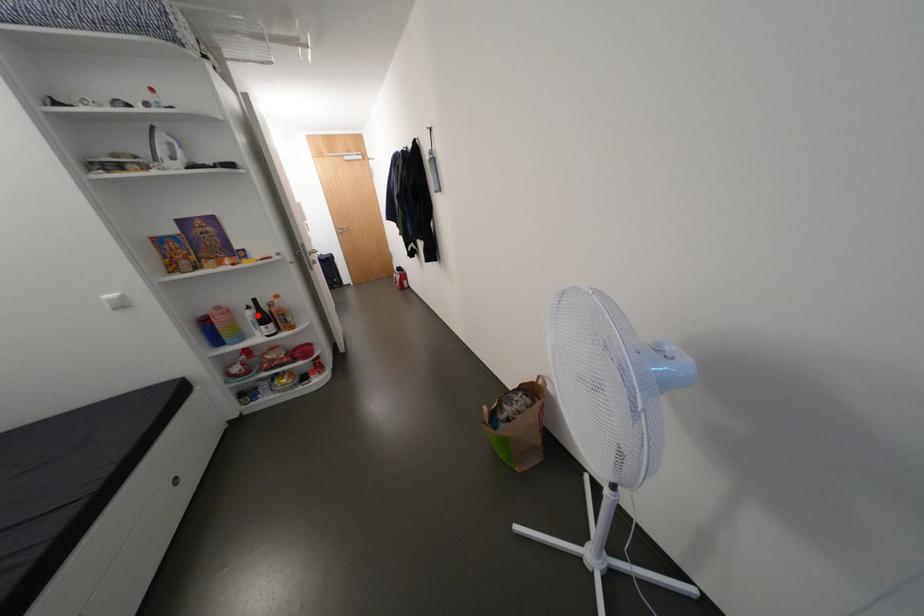
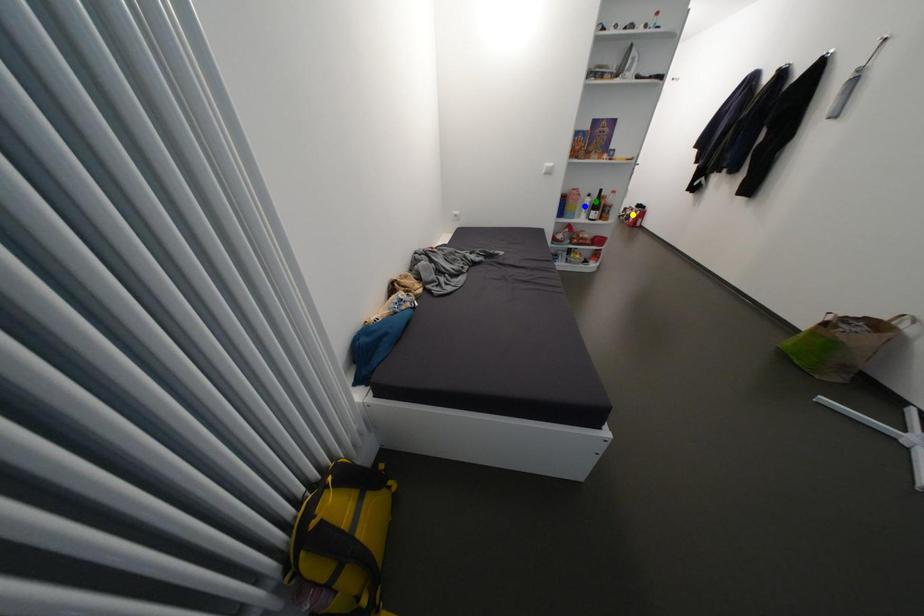
Question: I am providing you with two images of the same scene from different viewpoints. A red point is marked on the first image. You are given multiple points on the second image. In image 2, which mark is for the same physical point as the one in image 1?

Choices:
 (A) yellow point
 (B) blue point
 (C) green point

Answer: (C)